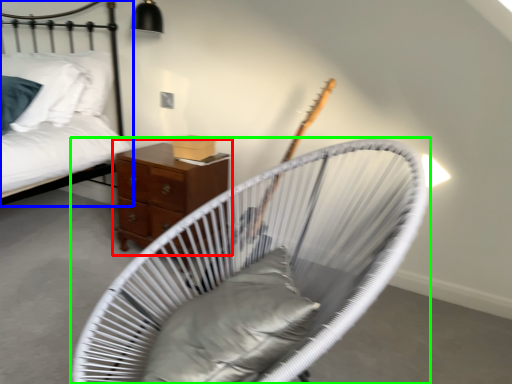
Question: Which object is positioned closest to nightstand (highlighted by a red box)? Select from bed (highlighted by a blue box) and furniture (highlighted by a green box).

Choices:
 (A) bed
 (B) furniture

Answer: (A)